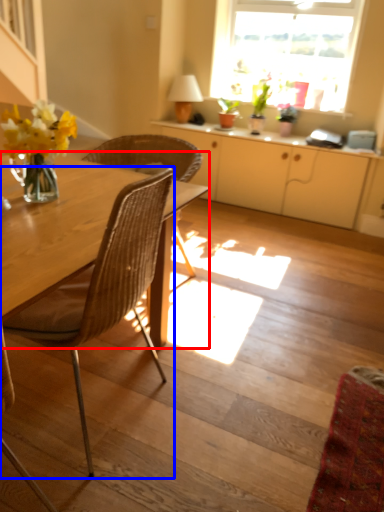
Question: Among these objects, which one is nearest to the camera, round table (highlighted by a red box) or chair (highlighted by a blue box)?

Choices:
 (A) round table
 (B) chair

Answer: (B)